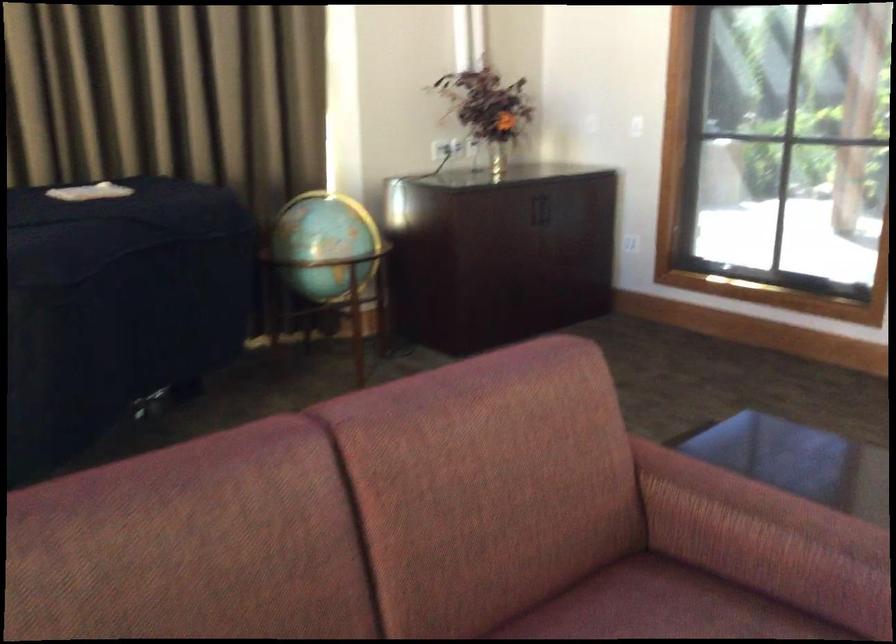
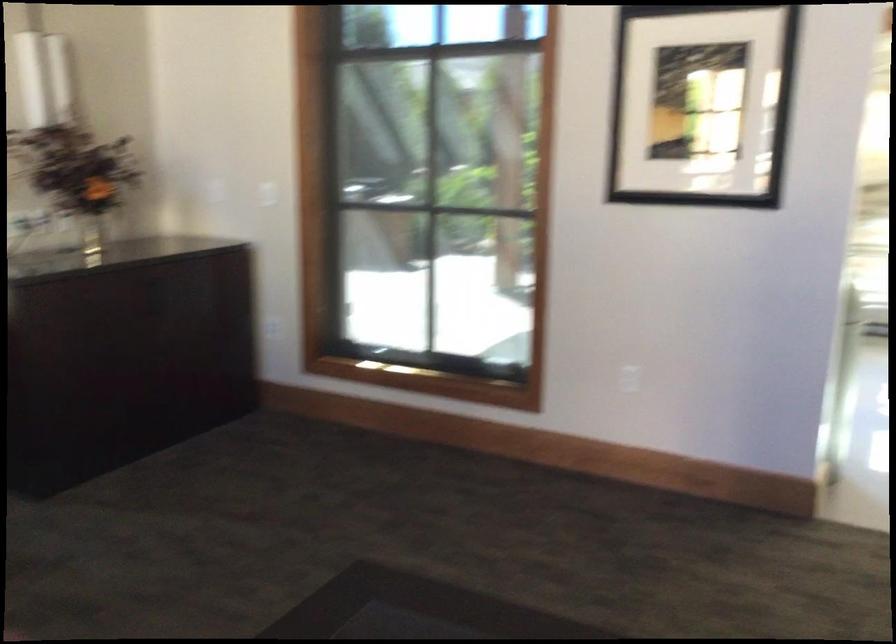
Question: The camera is either moving clockwise (left) or counter-clockwise (right) around the object. The first image is from the beginning of the video and the second image is from the end. Is the camera moving left or right when shooting the video?

Choices:
 (A) Left
 (B) Right

Answer: (A)